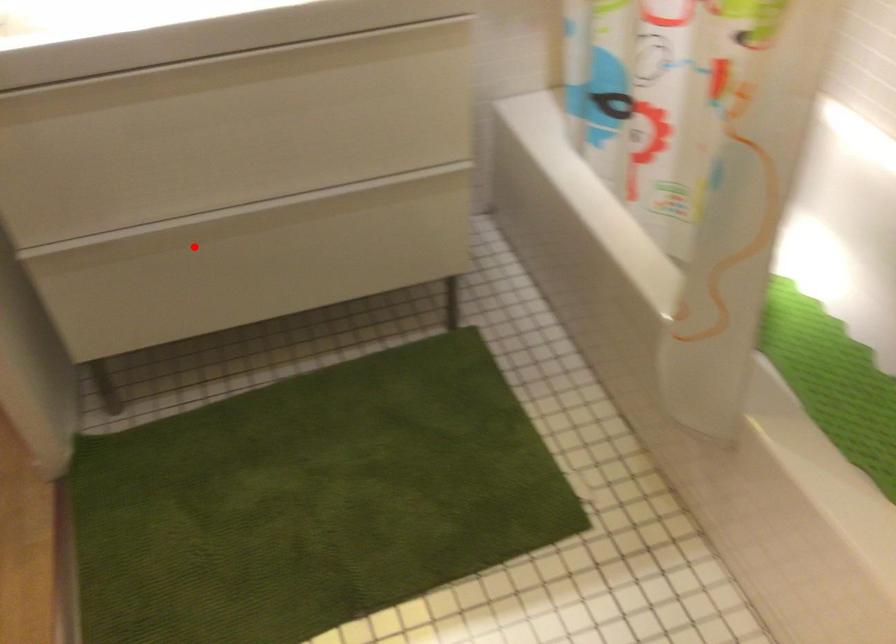
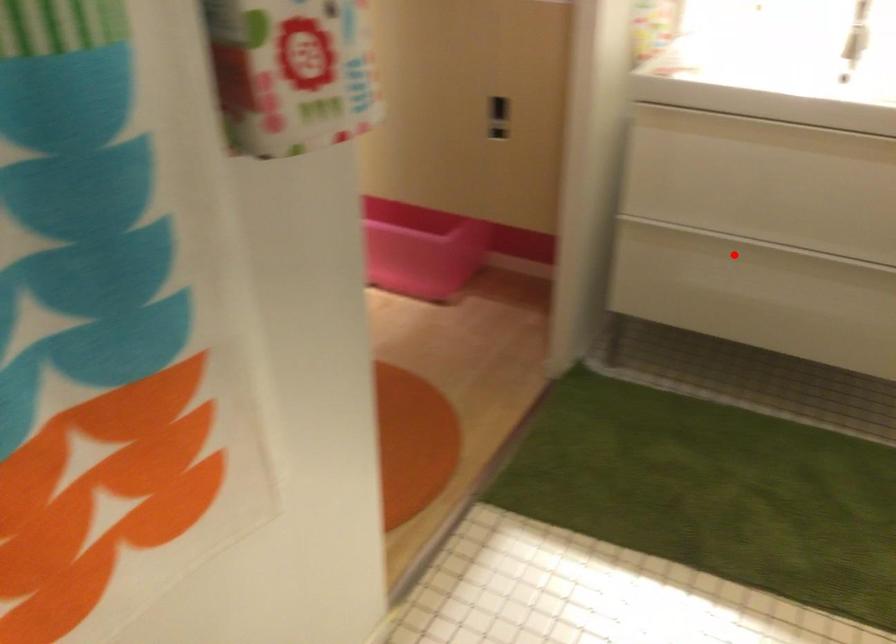
I am providing you with two images of the same scene from different viewpoints. A red point is marked on the first image and another point is marked on the second image. Is the marked point in image1 the same physical position as the marked point in image2?

Yes